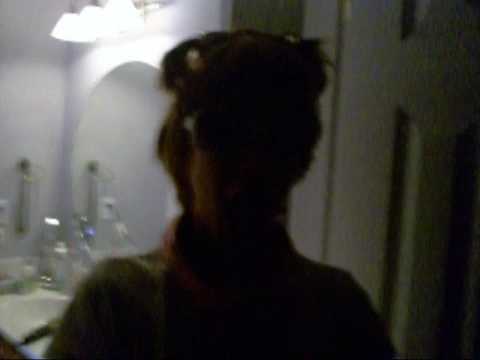
Where is `door`? The width and height of the screenshot is (480, 360). door is located at coordinates (388, 79).